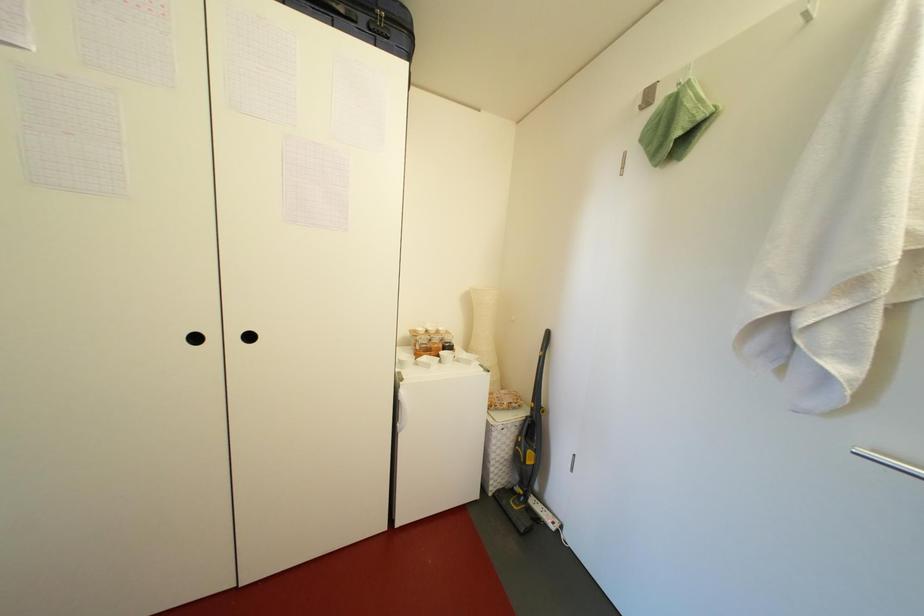
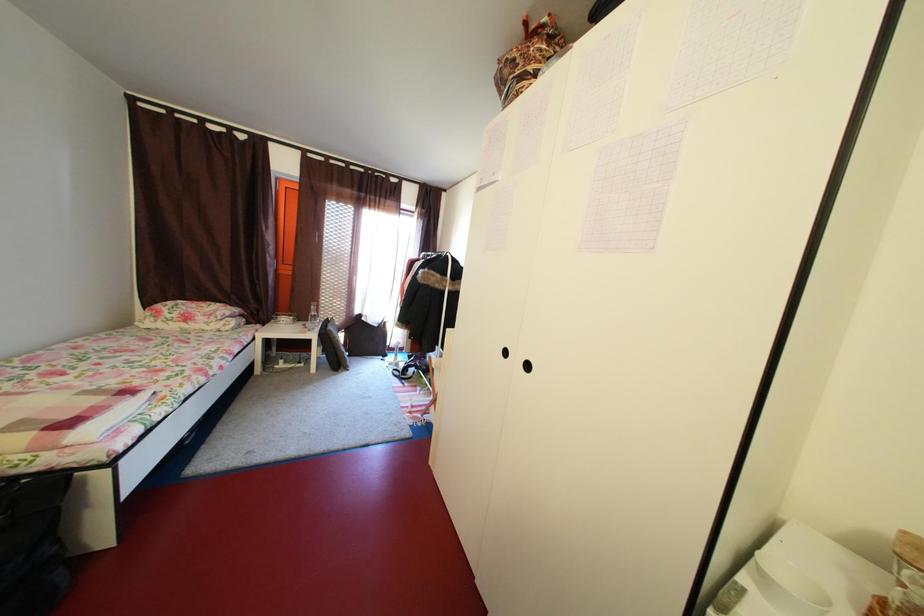
Question: The first image is from the beginning of the video and the second image is from the end. How did the camera likely rotate when shooting the video?

Choices:
 (A) Left
 (B) Right
 (C) Up
 (D) Down

Answer: (A)